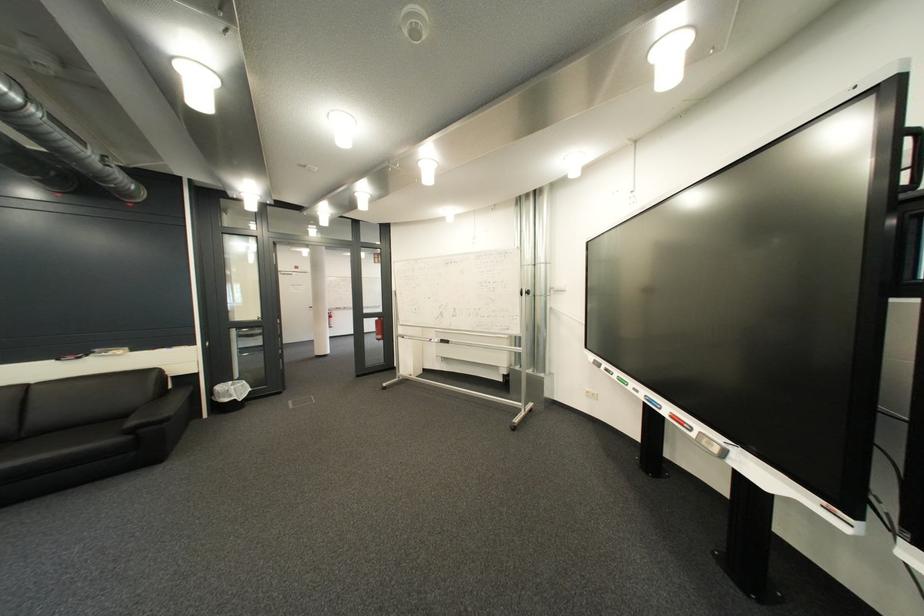
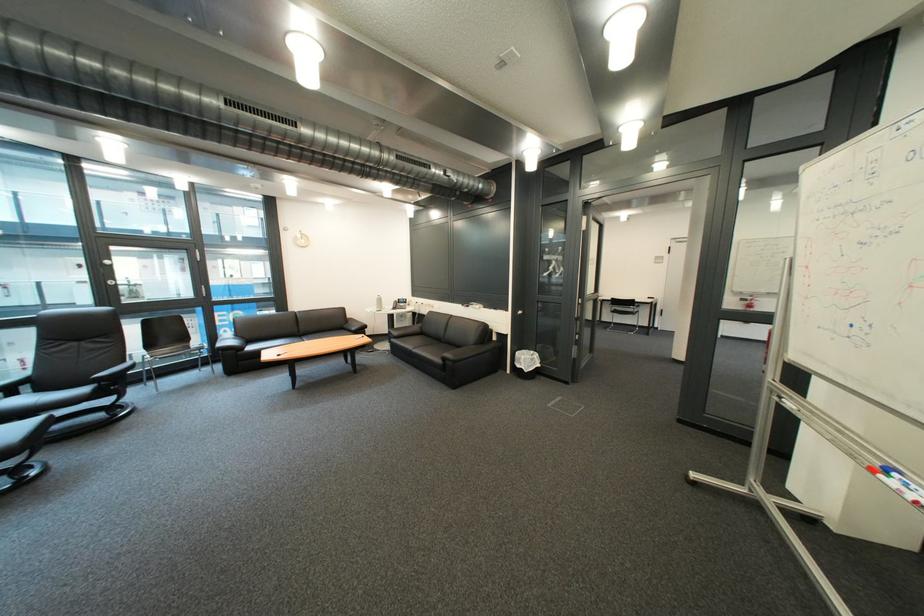
Where in the second image is the point corresponding to (444,341) from the first image?

(901, 472)